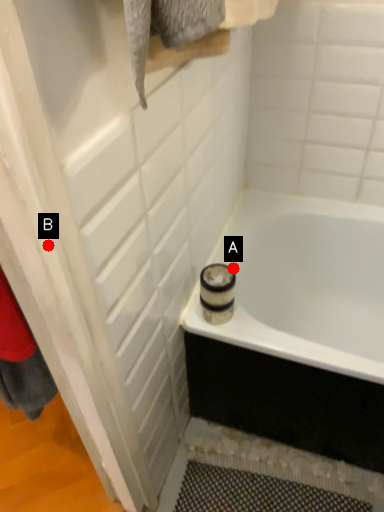
Question: Two points are circled on the image, labeled by A and B beside each circle. Which point is further to the camera?

Choices:
 (A) A is further
 (B) B is further

Answer: (A)